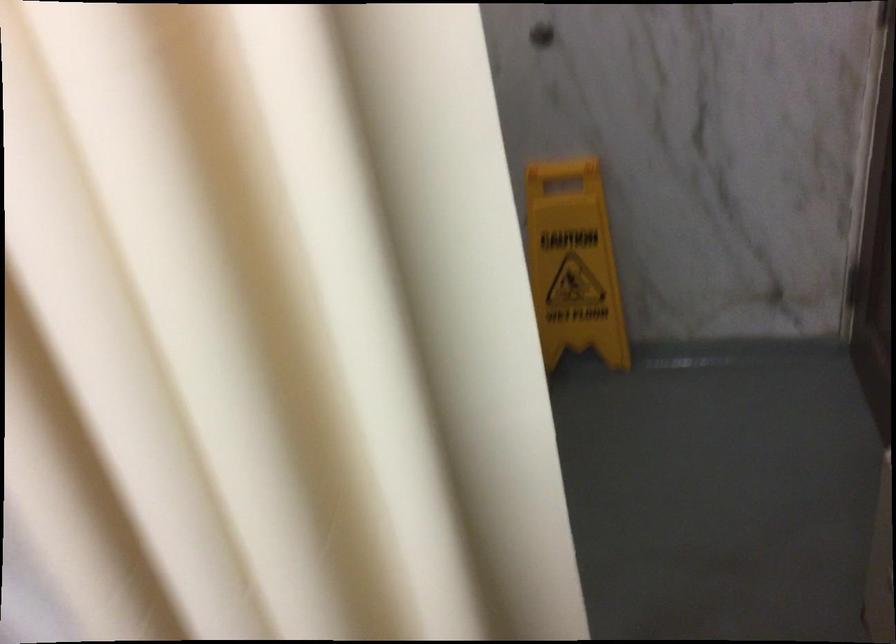
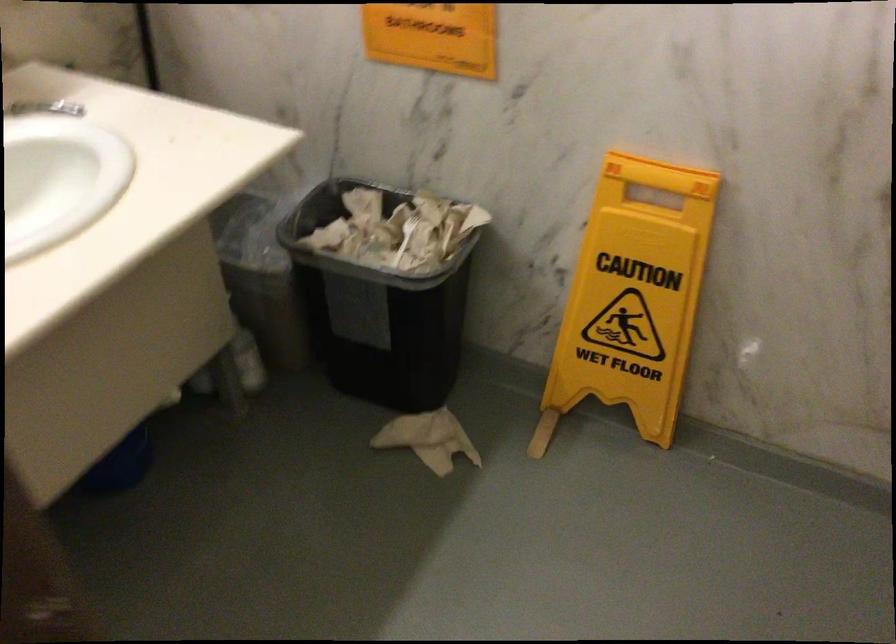
Question: The images are taken continuously from a first-person perspective. In which direction are you moving?

Choices:
 (A) Left
 (B) Right
 (C) Forward
 (D) Backward

Answer: (C)